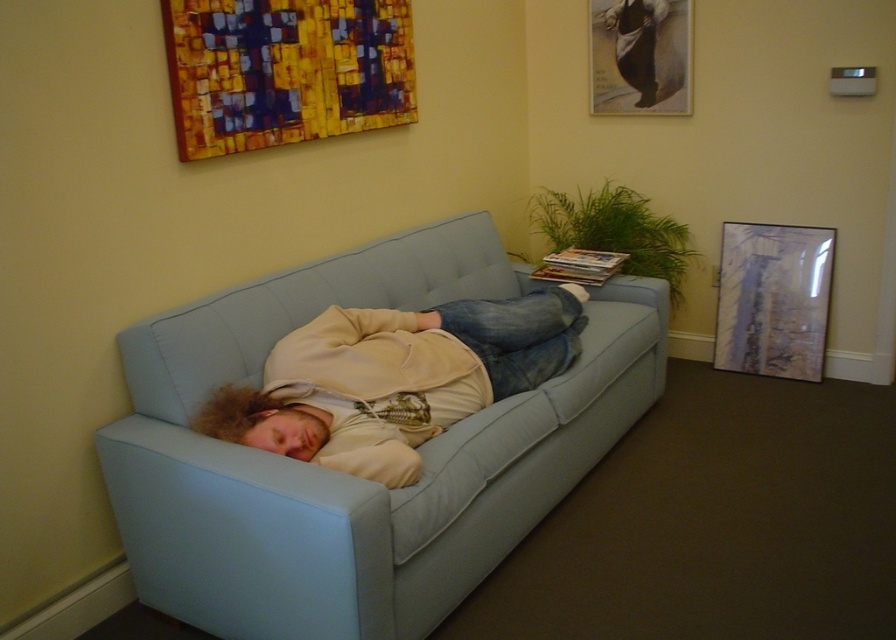
Which of these two, beige fleece jacket at center or matte glass picture frame at upper right, stands taller?

matte glass picture frame at upper right

At what (x,y) coordinates should I click in order to perform the action: click on beige fleece jacket at center. Please return your answer as a coordinate pair (x, y). The image size is (896, 640). Looking at the image, I should click on (395, 378).

Does point (352, 257) come in front of point (378, 419)?

No, it is not.

Who is more distant from viewer, (x=458, y=243) or (x=563, y=355)?

Point (x=458, y=243)

Locate an element on the screen. light blue fabric couch at center is located at coordinates (351, 476).

Is light blue fabric couch at center wider than matte paper picture frame at upper right?

Correct, the width of light blue fabric couch at center exceeds that of matte paper picture frame at upper right.

Between light blue fabric couch at center and matte paper picture frame at upper right, which one is positioned higher?

matte paper picture frame at upper right is higher up.

Is point (264, 552) closer to camera compared to point (617, 76)?

Yes, it is.

Where is `light blue fabric couch at center`? Image resolution: width=896 pixels, height=640 pixels. light blue fabric couch at center is located at coordinates (351, 476).